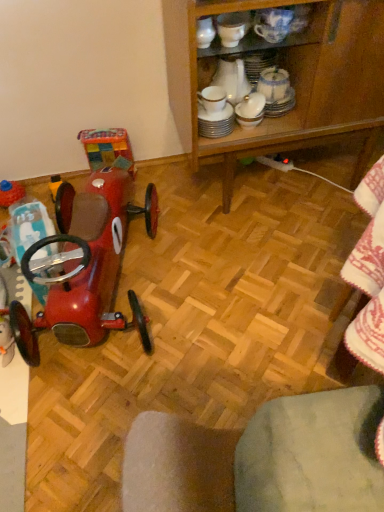
Find the location of a particular element. free point in front of wooden cabinet at center is located at coordinates (269, 277).